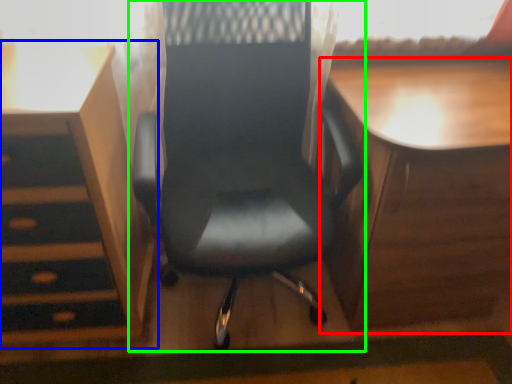
Question: Considering the real-world distances, which object is closest to table (highlighted by a red box)? vanity (highlighted by a blue box) or chair (highlighted by a green box).

Choices:
 (A) vanity
 (B) chair

Answer: (B)